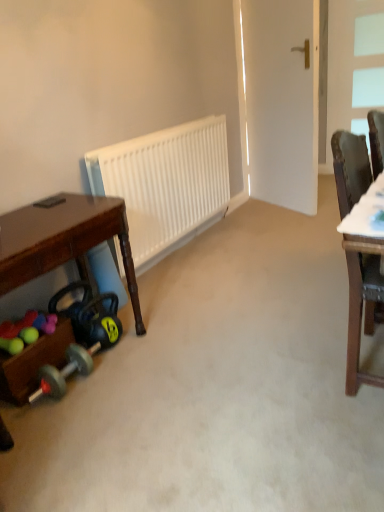
Identify the location of wooden toy box at lower left. Image resolution: width=384 pixels, height=512 pixels. (33, 362).

Describe the element at coordinates (165, 182) in the screenshot. The height and width of the screenshot is (512, 384). I see `white matte radiator at center` at that location.

Where is `white glass window at upper right`? white glass window at upper right is located at coordinates (368, 87).

Considering the points (361, 185) and (354, 84), which point is behind, point (361, 185) or point (354, 84)?

The point (354, 84) is farther from the camera.

Where is `window above the brown wood chair at right (from the image's perspective)`? window above the brown wood chair at right (from the image's perspective) is located at coordinates (368, 87).

Can you tell me how much brown wood chair at right and white glass window at upper right differ in facing direction?

92.4 degrees separate the facing orientations of brown wood chair at right and white glass window at upper right.

From the image's perspective, which object appears higher, brown wood chair at right or white glass window at upper right?

white glass window at upper right.

Is brown wooden desk at lower left looking in the opposite direction of white matte radiator at center?

No, brown wooden desk at lower left is not facing the opposite direction of white matte radiator at center.

Does brown wooden desk at lower left lie behind white matte radiator at center?

No, brown wooden desk at lower left is in front of white matte radiator at center.

How many degrees apart are the facing directions of brown wooden desk at lower left and white matte radiator at center?

There is a 0.34-degree angle between the facing directions of brown wooden desk at lower left and white matte radiator at center.

Between rubberized plastic balls at lower left and white glass window at upper right, which one has larger size?

white glass window at upper right.

In the scene shown: Is there a large distance between rubberized plastic balls at lower left and white glass window at upper right?

Indeed, rubberized plastic balls at lower left is not near white glass window at upper right.

Consider the image. From a real-world perspective, is rubberized plastic balls at lower left on white glass window at upper right?

Actually, rubberized plastic balls at lower left is physically below white glass window at upper right in the real world.

Between wooden toy box at lower left and brown wooden desk at lower left, which one has more height?

With more height is brown wooden desk at lower left.

Based on their sizes in the image, would you say wooden toy box at lower left is bigger or smaller than brown wooden desk at lower left?

In the image, wooden toy box at lower left appears to be smaller than brown wooden desk at lower left.

Is point (15, 398) farther from viewer compared to point (37, 365)?

No, (15, 398) is in front of (37, 365).

Does wooden toy box at lower left lie in front of brown wooden desk at lower left?

No, the depth of wooden toy box at lower left is greater than that of brown wooden desk at lower left.

Is wooden toy box at lower left oriented away from white glass window at upper right?

No, white glass window at upper right is not at the back of wooden toy box at lower left.

Looking at this image, which object is further away from the camera taking this photo, wooden toy box at lower left or white glass window at upper right?

white glass window at upper right is further away from the camera.

From the image's perspective, which object appears higher, wooden toy box at lower left or white glass window at upper right?

white glass window at upper right, from the image's perspective.

From a real-world perspective, who is located lower, wooden toy box at lower left or white glass window at upper right?

wooden toy box at lower left is physically lower.

Which of these two, white matte radiator at center or white glass window at upper right, is smaller?

white glass window at upper right is smaller.

From a real-world perspective, which object rests below the other?

From a 3D spatial view, white matte radiator at center is below.

Between white matte radiator at center and white glass window at upper right, which one is positioned behind?

white glass window at upper right is behind.

Can we say white matte radiator at center lies outside white glass window at upper right?

Yes, white matte radiator at center is located beyond the bounds of white glass window at upper right.

Is rubberized plastic balls at lower left at the back of white matte radiator at center?

white matte radiator at center is not turned away from rubberized plastic balls at lower left.

From a real-world perspective, is white matte radiator at center on rubberized plastic balls at lower left?

Yes, from a real-world perspective, white matte radiator at center is over rubberized plastic balls at lower left

Considering the relative positions of white matte radiator at center and rubberized plastic balls at lower left in the image provided, is white matte radiator at center to the right of rubberized plastic balls at lower left from the viewer's perspective?

Indeed, white matte radiator at center is positioned on the right side of rubberized plastic balls at lower left.

The image size is (384, 512). I want to click on radiator that is above the rubberized plastic balls at lower left (from a real-world perspective), so click(165, 182).

In order to click on chair located below the white glass window at upper right (from the image's perspective) in this screenshot , I will do point(350,168).

Find the location of `desk located underneath the white matte radiator at center (from a real-world perspective)`. desk located underneath the white matte radiator at center (from a real-world perspective) is located at coordinates (63, 241).

Estimate the real-world distances between objects in this image. Which object is further from white glass window at upper right, white matte radiator at center or brown wood chair at right?

The object further to white glass window at upper right is brown wood chair at right.

Considering their positions, is white matte radiator at center positioned further to white glass window at upper right than rubberized plastic balls at lower left?

Among the two, rubberized plastic balls at lower left is located further to white glass window at upper right.

Which object lies further to the anchor point white matte radiator at center, brown wood chair at right or white glass window at upper right?

white glass window at upper right is positioned further to the anchor white matte radiator at center.

When comparing their distances from white glass window at upper right, does white matte radiator at center or wooden toy box at lower left seem closer?

white matte radiator at center.

When comparing their distances from wooden toy box at lower left, does white glass window at upper right or white matte radiator at center seem further?

Based on the image, white glass window at upper right appears to be further to wooden toy box at lower left.

When comparing their distances from brown wood chair at right, does brown wooden desk at lower left or white glass window at upper right seem further?

white glass window at upper right.

Looking at the image, which one is located further to brown wooden desk at lower left, rubberized plastic balls at lower left or white glass window at upper right?

The object further to brown wooden desk at lower left is white glass window at upper right.

When comparing their distances from wooden toy box at lower left, does white matte radiator at center or rubberized plastic balls at lower left seem closer?

rubberized plastic balls at lower left is closer to wooden toy box at lower left.

Locate an element on the screen. The height and width of the screenshot is (512, 384). radiator situated between brown wooden desk at lower left and brown wood chair at right from left to right is located at coordinates (165, 182).

You are a GUI agent. You are given a task and a screenshot of the screen. Output one action in this format:
    pyautogui.click(x=<x>, y=<y>)
    Task: Click on the desk between brown wood chair at right and white glass window at upper right along the z-axis
    This screenshot has width=384, height=512.
    Given the screenshot: What is the action you would take?
    pyautogui.click(x=63, y=241)

Where is `desk between rubberized plastic balls at lower left and brown wood chair at right in the horizontal direction`? The height and width of the screenshot is (512, 384). desk between rubberized plastic balls at lower left and brown wood chair at right in the horizontal direction is located at coordinates (63, 241).

This screenshot has width=384, height=512. In order to click on radiator between rubberized plastic balls at lower left and brown wood chair at right in this screenshot , I will do `click(165, 182)`.